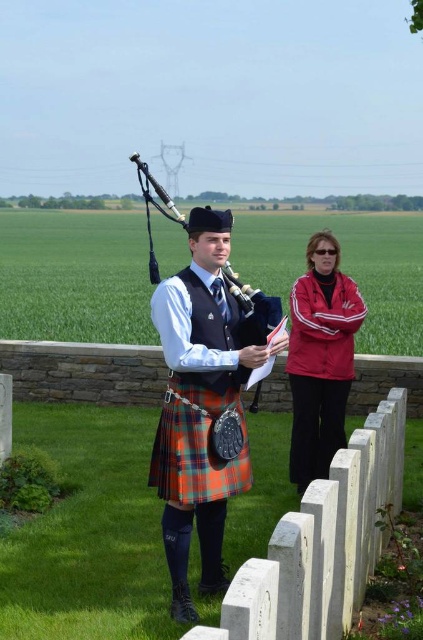
What do you see at coordinates (195, 448) in the screenshot?
I see `plaid wool kilt at center` at bounding box center [195, 448].

Does plaid wool kilt at center appear under polished wood bagpipe at center?

Indeed, plaid wool kilt at center is positioned under polished wood bagpipe at center.

Is point (173, 486) in front of point (241, 298)?

Yes, it is.

Identify the location of plaid wool kilt at center. Image resolution: width=423 pixels, height=640 pixels. (195, 448).

Is orange plaid kilt at center smaller than plaid wool kilt at center?

Actually, orange plaid kilt at center might be larger than plaid wool kilt at center.

Between point (173, 477) and point (165, 477), which one is positioned in front?

Positioned in front is point (173, 477).

Which is behind, point (222, 419) or point (180, 454)?

The point (222, 419) is more distant.

You are a GUI agent. You are given a task and a screenshot of the screen. Output one action in this format:
    pyautogui.click(x=<x>, y=<y>)
    Task: Click on the orange plaid kilt at center
    The image size is (423, 640).
    Given the screenshot: What is the action you would take?
    pyautogui.click(x=203, y=403)

Is point (225, 486) closer to viewer compared to point (331, 376)?

Yes, point (225, 486) is in front of point (331, 376).

Who is more forward, (203,580) or (340,291)?

Point (203,580) is more forward.

The image size is (423, 640). In order to click on orange plaid kilt at center in this screenshot , I will do `click(203, 403)`.